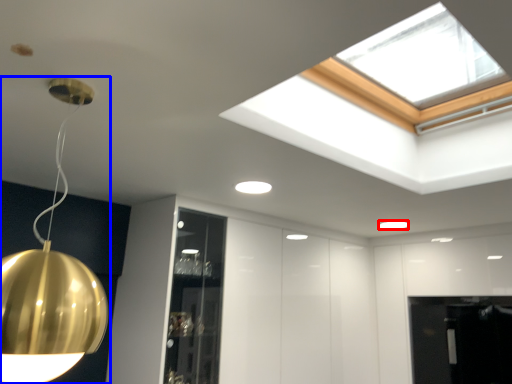
Question: Among these objects, which one is farthest to the camera, lamp (highlighted by a red box) or lamp (highlighted by a blue box)?

Choices:
 (A) lamp
 (B) lamp

Answer: (A)